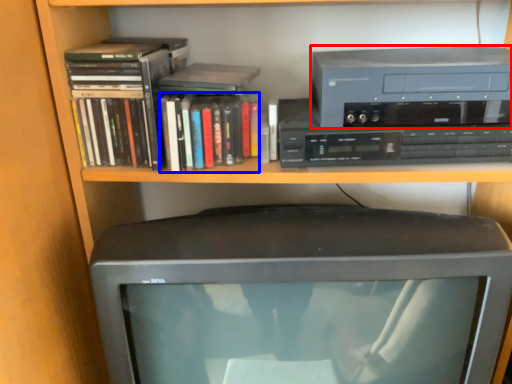
Question: Which of the following is the farthest to the observer, cassette (highlighted by a red box) or book (highlighted by a blue box)?

Choices:
 (A) cassette
 (B) book

Answer: (B)